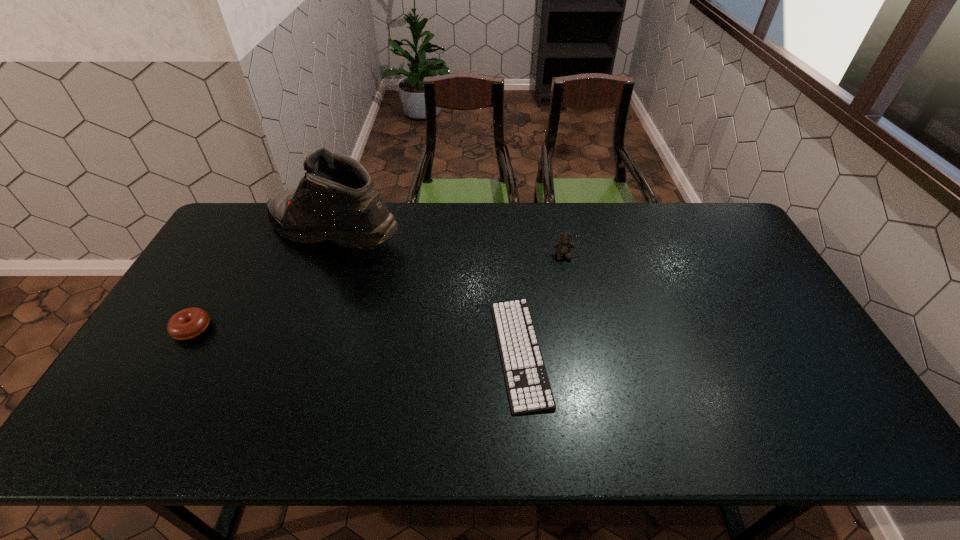
Identify the location of vacant space that is in between the doughnut and the tallest object. Image resolution: width=960 pixels, height=540 pixels. tap(263, 280).

This screenshot has height=540, width=960. I want to click on unoccupied position between the second tallest object and the leftmost object, so click(x=377, y=292).

This screenshot has height=540, width=960. In order to click on vacant area that lies between the doughnut and the shortest object in this screenshot , I will do `click(356, 340)`.

This screenshot has width=960, height=540. In order to click on free spot between the computer keyboard and the rightmost object in this screenshot , I will do `click(541, 304)`.

Select which object appears as the second closest to the leftmost object. Please provide its 2D coordinates. Your answer should be formatted as a tuple, i.e. [(x, y)], where the tuple contains the x and y coordinates of a point satisfying the conditions above.

[(529, 391)]

What are the coordinates of `object that stands as the third closest to the shortest object` in the screenshot? It's located at (188, 323).